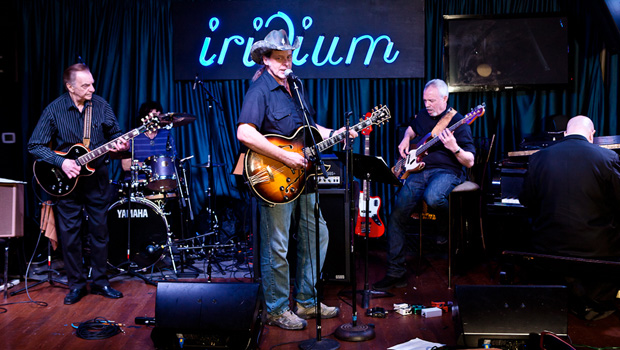
Where is `curtain`? The width and height of the screenshot is (620, 350). curtain is located at coordinates (140, 62), (330, 100), (402, 97), (521, 113).